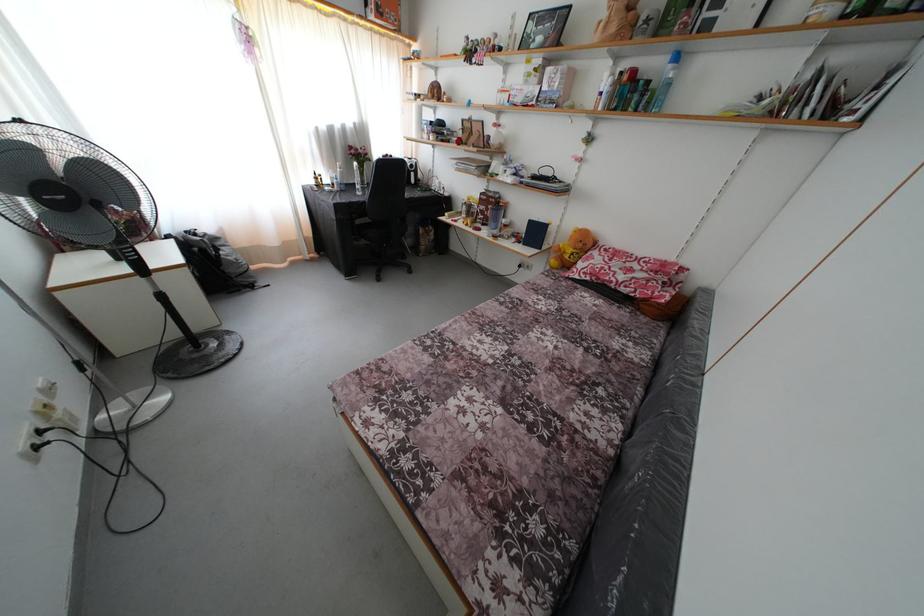
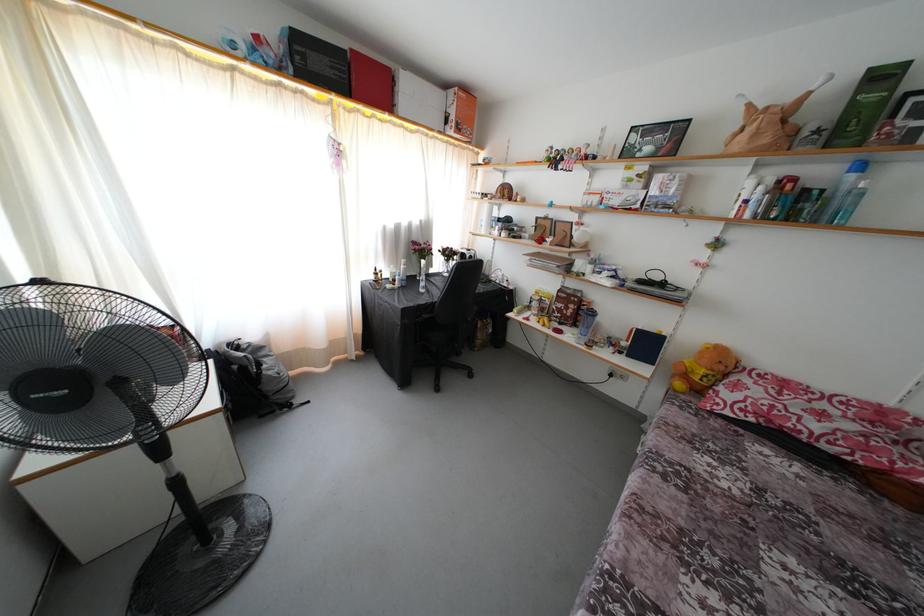
Find the pixel in the second image that matches the point at 604,261 in the first image.

(760, 389)